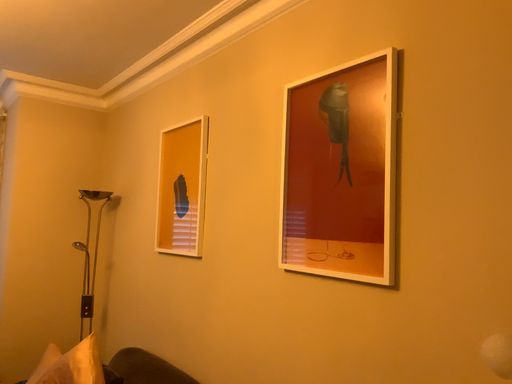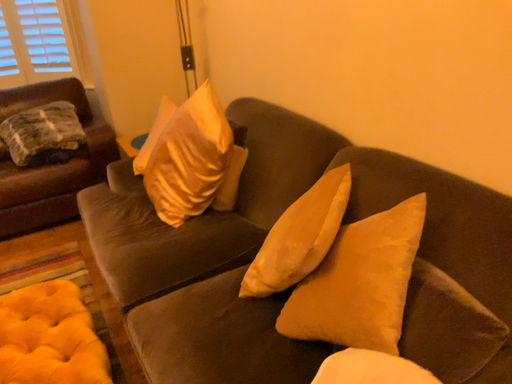
Question: Which way did the camera rotate in the video?

Choices:
 (A) rotated upward
 (B) rotated downward

Answer: (B)